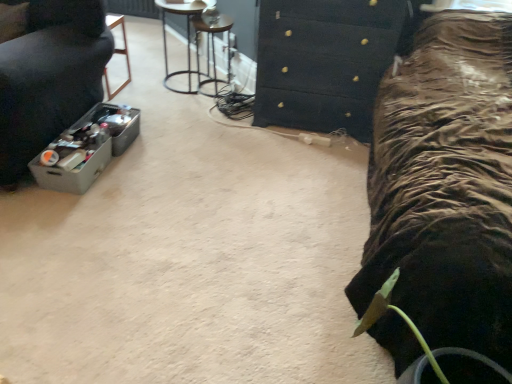
Question: Is the position of metallic wireframe stool at upper center more distant than that of gray plastic container at left, which is the first furniture from left to right?

Choices:
 (A) yes
 (B) no

Answer: (A)

Question: From the image's perspective, would you say metallic wireframe stool at upper center is shown under gray plastic container at left, placed as the 2th furniture when sorted from right to left?

Choices:
 (A) yes
 (B) no

Answer: (B)

Question: Can you confirm if metallic wireframe stool at upper center is smaller than gray plastic container at left, the second furniture from the back?

Choices:
 (A) yes
 (B) no

Answer: (A)

Question: Can you confirm if metallic wireframe stool at upper center is bigger than gray plastic container at left, the second furniture from the back?

Choices:
 (A) yes
 (B) no

Answer: (B)

Question: Does metallic wireframe stool at upper center have a lesser width compared to gray plastic container at left, which ranks as the first furniture in front-to-back order?

Choices:
 (A) no
 (B) yes

Answer: (B)

Question: Considering the positions of gray plastic container at left, placed as the 2th furniture when sorted from right to left, and metallic wire side table at upper center, which ranks as the second furniture in front-to-back order, in the image, is gray plastic container at left, placed as the 2th furniture when sorted from right to left, bigger or smaller than metallic wire side table at upper center, which ranks as the second furniture in front-to-back order,?

Choices:
 (A) big
 (B) small

Answer: (A)

Question: Is point (38, 92) positioned closer to the camera than point (195, 11)?

Choices:
 (A) farther
 (B) closer

Answer: (B)

Question: From a real-world perspective, is gray plastic container at left, the second furniture from the back, above or below metallic wire side table at upper center, acting as the 1th furniture starting from the back?

Choices:
 (A) above
 (B) below

Answer: (A)

Question: Is gray plastic container at left, which is the first furniture from left to right, inside or outside of metallic wire side table at upper center, which ranks as the second furniture in front-to-back order?

Choices:
 (A) inside
 (B) outside

Answer: (B)

Question: Does point (194, 23) appear closer or farther from the camera than point (295, 74)?

Choices:
 (A) farther
 (B) closer

Answer: (A)

Question: Based on their positions, is metallic wireframe stool at upper center located to the left or right of black textured chest of drawers at upper center?

Choices:
 (A) right
 (B) left

Answer: (B)

Question: From a real-world perspective, relative to black textured chest of drawers at upper center, is metallic wireframe stool at upper center vertically above or below?

Choices:
 (A) above
 (B) below

Answer: (B)

Question: Is metallic wireframe stool at upper center taller or shorter than black textured chest of drawers at upper center?

Choices:
 (A) short
 (B) tall

Answer: (A)

Question: Considering the positions of metallic wireframe stool at upper center and gray plastic container at left, placed as the 2th furniture when sorted from right to left, in the image, is metallic wireframe stool at upper center taller or shorter than gray plastic container at left, placed as the 2th furniture when sorted from right to left,?

Choices:
 (A) short
 (B) tall

Answer: (A)

Question: From the image's perspective, is metallic wireframe stool at upper center above or below gray plastic container at left, placed as the 2th furniture when sorted from right to left?

Choices:
 (A) above
 (B) below

Answer: (A)